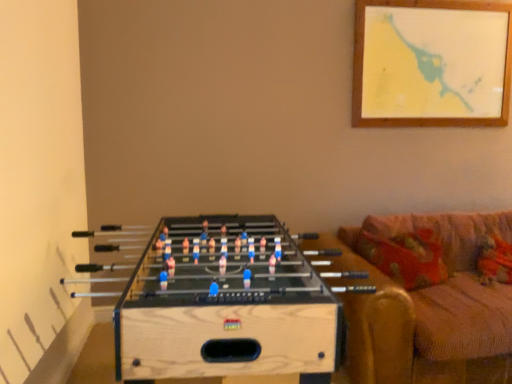
Question: Is velvet orange couch at right at the left side of natural wood foosball table at lower left?

Choices:
 (A) yes
 (B) no

Answer: (B)

Question: Is velvet orange couch at right looking in the opposite direction of natural wood foosball table at lower left?

Choices:
 (A) yes
 (B) no

Answer: (B)

Question: Is velvet orange couch at right positioned behind natural wood foosball table at lower left?

Choices:
 (A) no
 (B) yes

Answer: (B)

Question: From the image's perspective, would you say velvet orange couch at right is shown under natural wood foosball table at lower left?

Choices:
 (A) yes
 (B) no

Answer: (B)

Question: Does velvet orange couch at right appear on the right side of natural wood foosball table at lower left?

Choices:
 (A) no
 (B) yes

Answer: (B)

Question: Is velvet orange couch at right bigger than natural wood foosball table at lower left?

Choices:
 (A) no
 (B) yes

Answer: (B)

Question: Is natural wood foosball table at lower left shorter than velvet orange couch at right?

Choices:
 (A) yes
 (B) no

Answer: (B)

Question: Is natural wood foosball table at lower left next to velvet orange couch at right?

Choices:
 (A) no
 (B) yes

Answer: (A)

Question: Is natural wood foosball table at lower left oriented towards velvet orange couch at right?

Choices:
 (A) yes
 (B) no

Answer: (A)

Question: Does natural wood foosball table at lower left have a smaller size compared to velvet orange couch at right?

Choices:
 (A) no
 (B) yes

Answer: (B)

Question: From the image's perspective, is natural wood foosball table at lower left located above velvet orange couch at right?

Choices:
 (A) no
 (B) yes

Answer: (A)

Question: Does natural wood foosball table at lower left appear on the left side of velvet orange couch at right?

Choices:
 (A) no
 (B) yes

Answer: (B)

Question: Is natural wood foosball table at lower left wider or thinner than velvet orange couch at right?

Choices:
 (A) thin
 (B) wide

Answer: (A)